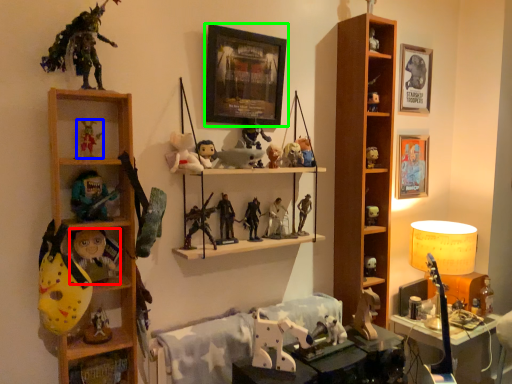
Question: Considering the real-world distances, which object is farthest from toy (highlighted by a red box)? toy (highlighted by a blue box) or picture frame (highlighted by a green box)?

Choices:
 (A) toy
 (B) picture frame

Answer: (B)